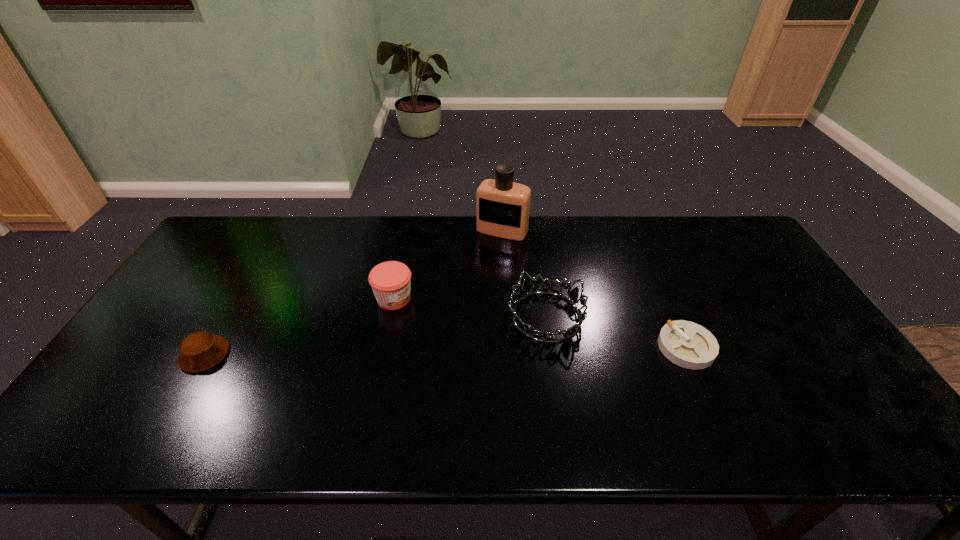
What are the coordinates of `free spot between the jam and the muffin` in the screenshot? It's located at (300, 327).

Locate an element on the screen. This screenshot has height=540, width=960. free area in between the tiara and the shortest object is located at coordinates (616, 332).

Find the location of `vacant area between the farthest object and the muffin`. vacant area between the farthest object and the muffin is located at coordinates (353, 293).

The width and height of the screenshot is (960, 540). I want to click on vacant area that lies between the shortest object and the tiara, so click(x=616, y=332).

Locate an element on the screen. This screenshot has height=540, width=960. unoccupied area between the jam and the farthest object is located at coordinates (448, 265).

I want to click on vacant point located between the jam and the second shortest object, so click(300, 327).

This screenshot has width=960, height=540. I want to click on object that stands as the second closest to the second object from left to right, so click(502, 206).

Where is `object that can be found as the second closest to the leftmost object`? Image resolution: width=960 pixels, height=540 pixels. object that can be found as the second closest to the leftmost object is located at coordinates (526, 291).

At what (x,y) coordinates should I click in order to perform the action: click on free space that satisfies the following two spatial constraints: 1. on the front side of the ashtray; 2. on the right side of the farthest object. Please return your answer as a coordinate pair (x, y). This screenshot has height=540, width=960. Looking at the image, I should click on (510, 347).

Identify the location of vacant position in the image that satisfies the following two spatial constraints: 1. on the front side of the rightmost object; 2. on the right side of the jam. (384, 347).